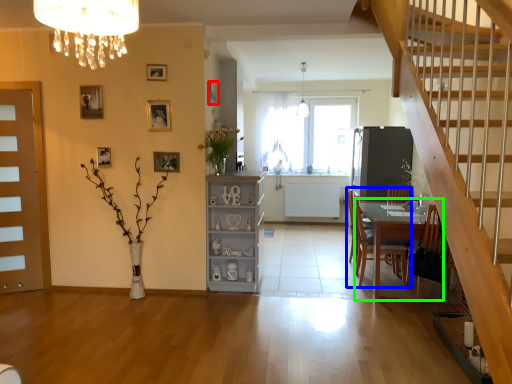
Question: Which is nearer to the picture frame (highlighted by a red box)? chair (highlighted by a blue box) or table (highlighted by a green box).

Choices:
 (A) chair
 (B) table

Answer: (A)